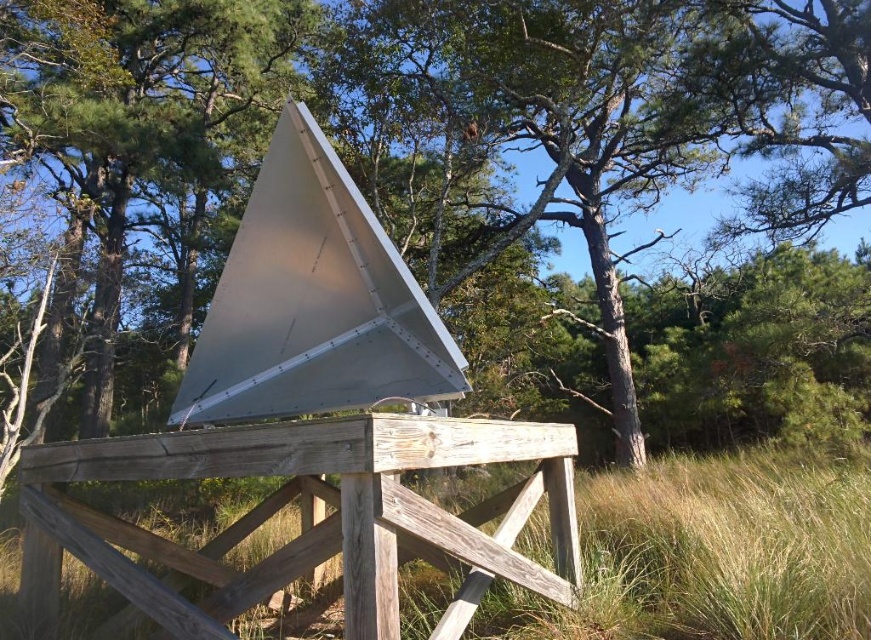
You are standing at the base of the wooden platform and want to look up at the green leafy tree at upper center. In which general direction should you turn your head to see it?

The green leafy tree at upper center is located at point coordinates, so you should look upward and towards the center of the scene to see it.

Consider the image. You are standing on the wooden platform looking at the scene. Which object is positioned higher relative to the other between the green leafy tree at upper center and the grassy brown at center?

The green leafy tree at upper center is located above the grassy brown at center, so it is positioned higher relative to the grassy brown at center.